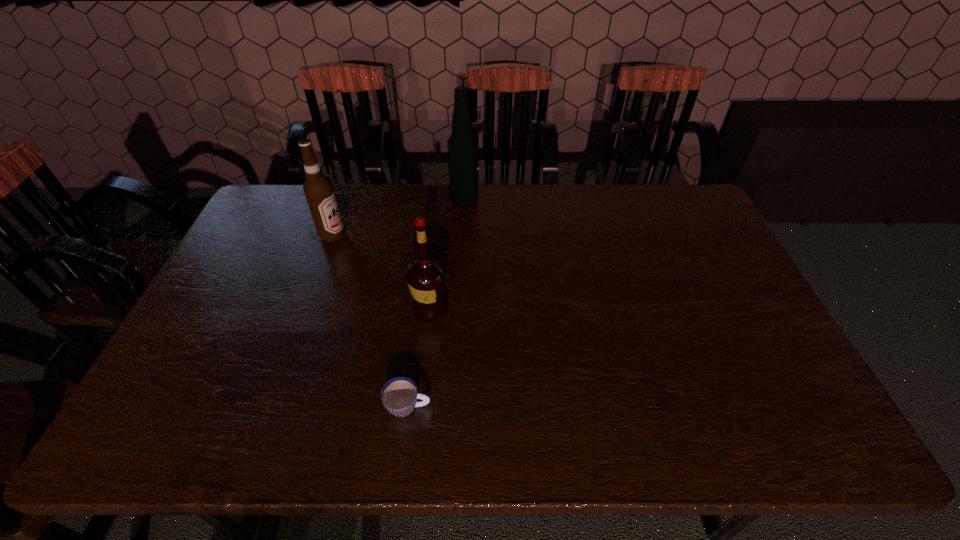
Find the location of a particular element. vacant area that lies between the nearest object and the second nearest alcohol is located at coordinates (371, 321).

Identify the location of free area in between the cup and the leftmost alcohol. coord(371,321).

At what (x,y) coordinates should I click in order to perform the action: click on unoccupied position between the second farthest alcohol and the shortest object. Please return your answer as a coordinate pair (x, y). Image resolution: width=960 pixels, height=540 pixels. Looking at the image, I should click on (371, 321).

Locate an element on the screen. free spot between the nearest alcohol and the farthest alcohol is located at coordinates (447, 254).

I want to click on unoccupied area between the tallest alcohol and the third farthest object, so click(x=447, y=254).

Where is `vacant space that's between the shortest object and the second farthest alcohol`? vacant space that's between the shortest object and the second farthest alcohol is located at coordinates (371, 321).

Locate an element on the screen. empty space that is in between the third farthest object and the second nearest alcohol is located at coordinates (381, 272).

Locate an element on the screen. The image size is (960, 540). free spot between the nearest alcohol and the nearest object is located at coordinates (420, 357).

The width and height of the screenshot is (960, 540). What are the coordinates of `object that stands as the closest to the nearest object` in the screenshot? It's located at (426, 276).

Identify which object is the second nearest to the leftmost object. Please provide its 2D coordinates. Your answer should be formatted as a tuple, i.e. [(x, y)], where the tuple contains the x and y coordinates of a point satisfying the conditions above.

[(463, 147)]